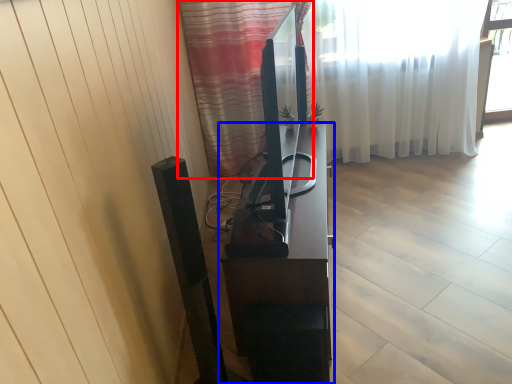
Question: Which object is further to the camera taking this photo, curtain (highlighted by a red box) or furniture (highlighted by a blue box)?

Choices:
 (A) curtain
 (B) furniture

Answer: (B)